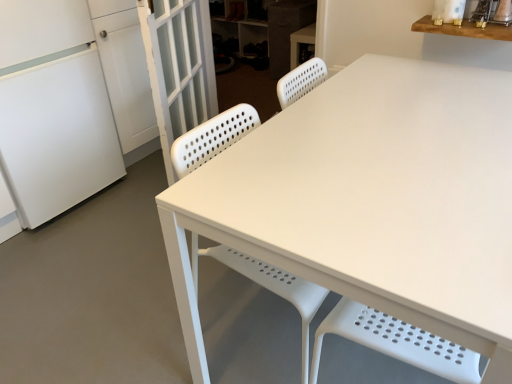
Question: Considering the relative positions of wooden shelf at upper right and white matte cabinet at upper center, the 1th cabinetry in the back-to-front sequence, in the image provided, is wooden shelf at upper right behind white matte cabinet at upper center, the 1th cabinetry in the back-to-front sequence,?

Choices:
 (A) yes
 (B) no

Answer: (B)

Question: Could you tell me if wooden shelf at upper right is turned towards white matte cabinet at upper center, positioned as the 2th cabinetry in front-to-back order?

Choices:
 (A) no
 (B) yes

Answer: (A)

Question: From the image's perspective, would you say wooden shelf at upper right is shown under white matte cabinet at upper center, the 1th cabinetry in the back-to-front sequence?

Choices:
 (A) yes
 (B) no

Answer: (A)

Question: Does wooden shelf at upper right have a lesser width compared to white matte cabinet at upper center, the 1th cabinetry in the back-to-front sequence?

Choices:
 (A) yes
 (B) no

Answer: (A)

Question: Can you confirm if wooden shelf at upper right is taller than white matte cabinet at upper center, positioned as the 2th cabinetry in front-to-back order?

Choices:
 (A) no
 (B) yes

Answer: (A)

Question: Is point (154, 81) positioned closer to the camera than point (282, 51)?

Choices:
 (A) closer
 (B) farther

Answer: (A)

Question: From the image's perspective, relative to gray fabric cabinet at upper center, the first cabinetry viewed from the front, is white textured screen door at left above or below?

Choices:
 (A) above
 (B) below

Answer: (B)

Question: Considering the positions of white textured screen door at left and gray fabric cabinet at upper center, which ranks as the 2th cabinetry in back-to-front order, in the image, is white textured screen door at left taller or shorter than gray fabric cabinet at upper center, which ranks as the 2th cabinetry in back-to-front order,?

Choices:
 (A) short
 (B) tall

Answer: (B)

Question: Considering the positions of white textured screen door at left and gray fabric cabinet at upper center, the first cabinetry viewed from the front, in the image, is white textured screen door at left wider or thinner than gray fabric cabinet at upper center, the first cabinetry viewed from the front,?

Choices:
 (A) wide
 (B) thin

Answer: (B)

Question: Is white textured screen door at left to the left or to the right of wooden shelf at upper right in the image?

Choices:
 (A) right
 (B) left

Answer: (B)

Question: Is point (190, 105) positioned closer to the camera than point (509, 23)?

Choices:
 (A) closer
 (B) farther

Answer: (B)

Question: Looking at their shapes, would you say white textured screen door at left is wider or thinner than wooden shelf at upper right?

Choices:
 (A) wide
 (B) thin

Answer: (B)

Question: From a real-world perspective, is white textured screen door at left above or below wooden shelf at upper right?

Choices:
 (A) above
 (B) below

Answer: (B)

Question: Would you say white matte refrigerator at left is to the left or to the right of wooden shelf at upper right in the picture?

Choices:
 (A) left
 (B) right

Answer: (A)

Question: From a real-world perspective, relative to wooden shelf at upper right, is white matte refrigerator at left vertically above or below?

Choices:
 (A) above
 (B) below

Answer: (B)